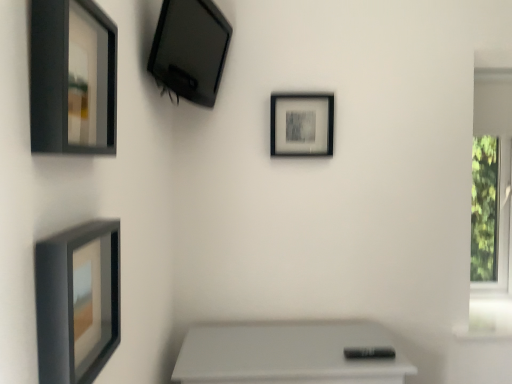
Question: Considering the positions of matte black picture frame at upper left, placed as the first picture frame when sorted from left to right, and matte black picture frame at center, the 1th picture frame in the back-to-front sequence, in the image, is matte black picture frame at upper left, placed as the first picture frame when sorted from left to right, bigger or smaller than matte black picture frame at center, the 1th picture frame in the back-to-front sequence,?

Choices:
 (A) small
 (B) big

Answer: (B)

Question: From the image's perspective, is matte black picture frame at upper left, arranged as the 2th picture frame when ordered from the bottom, positioned above or below matte black picture frame at center, the 1th picture frame positioned from the right?

Choices:
 (A) below
 (B) above

Answer: (A)

Question: Which object is positioned closest to the matte black tv at upper left, the 1th picture frame when ordered from top to bottom?

Choices:
 (A) matte black picture frame at center, placed as the second picture frame when sorted from top to bottom
 (B) matte black picture frame at upper left, which appears as the 4th picture frame when viewed from the right
 (C) white plastic window frame at right
 (D) matte black picture frame at lower left, placed as the first picture frame when sorted from bottom to top

Answer: (A)

Question: Which is farther from the matte black picture frame at upper left, the fourth picture frame in the back-to-front sequence?

Choices:
 (A) matte black tv at upper left, the 1th picture frame when ordered from top to bottom
 (B) white plastic window frame at right
 (C) matte black picture frame at center, placed as the second picture frame when sorted from top to bottom
 (D) matte black picture frame at lower left, the second picture frame positioned from the front

Answer: (B)